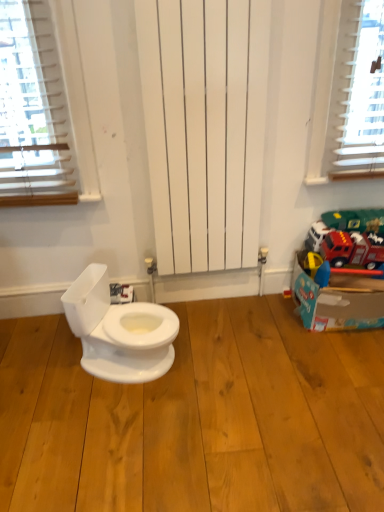
Question: Considering their positions, is cardboard box at right located in front of or behind light brown wood flooring at center?

Choices:
 (A) front
 (B) behind

Answer: (B)

Question: In the image, is cardboard box at right on the left side or the right side of light brown wood flooring at center?

Choices:
 (A) right
 (B) left

Answer: (A)

Question: Considering the positions of cardboard box at right and light brown wood flooring at center in the image, is cardboard box at right bigger or smaller than light brown wood flooring at center?

Choices:
 (A) small
 (B) big

Answer: (A)

Question: From the image's perspective, is light brown wood flooring at center positioned above or below cardboard box at right?

Choices:
 (A) below
 (B) above

Answer: (A)

Question: Is light brown wood flooring at center situated inside cardboard box at right or outside?

Choices:
 (A) inside
 (B) outside

Answer: (B)

Question: From a real-world perspective, is light brown wood flooring at center positioned above or below cardboard box at right?

Choices:
 (A) below
 (B) above

Answer: (A)

Question: Is light brown wood flooring at center taller or shorter than cardboard box at right?

Choices:
 (A) tall
 (B) short

Answer: (B)